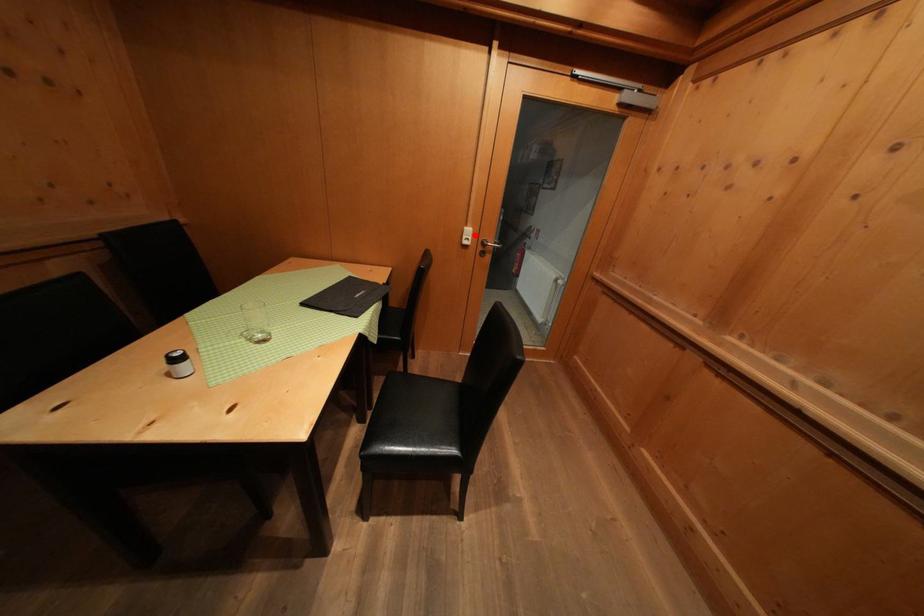
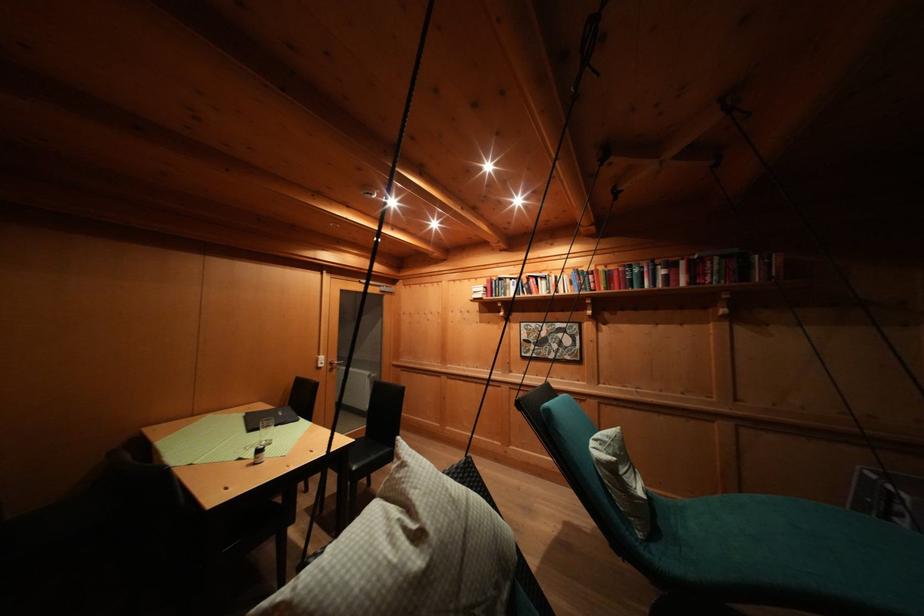
The point at the highlighted location is marked in the first image. Where is the corresponding point in the second image?

(327, 362)